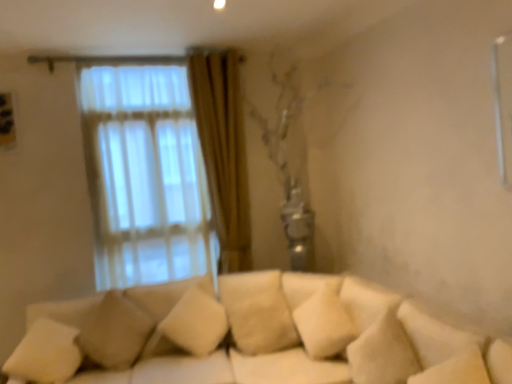
Question: Is white soft pillow at lower left, which appears as the 3th pillow when viewed from the right, a part of beige fabric pillow at center, the third pillow when ordered from left to right?

Choices:
 (A) no
 (B) yes

Answer: (A)

Question: Can you confirm if beige fabric pillow at center, the third pillow when ordered from left to right, is smaller than white soft pillow at lower left, which appears as the 3th pillow when viewed from the right?

Choices:
 (A) no
 (B) yes

Answer: (A)

Question: Is the position of beige fabric pillow at center, the first pillow from the right, less distant than that of white soft pillow at lower left, which is the 1th pillow in left-to-right order?

Choices:
 (A) no
 (B) yes

Answer: (A)

Question: Can you confirm if beige fabric pillow at center, the third pillow when ordered from left to right, is thinner than white soft pillow at lower left, which is the 1th pillow in left-to-right order?

Choices:
 (A) no
 (B) yes

Answer: (A)

Question: Considering the relative sizes of beige fabric pillow at center, the first pillow from the right, and white soft pillow at lower left, which appears as the 3th pillow when viewed from the right, in the image provided, is beige fabric pillow at center, the first pillow from the right, bigger than white soft pillow at lower left, which appears as the 3th pillow when viewed from the right,?

Choices:
 (A) yes
 (B) no

Answer: (A)

Question: From a real-world perspective, is beige fabric pillow at lower left, the second pillow viewed from the right, physically located above or below white soft pillow at lower left, which is the 1th pillow in left-to-right order?

Choices:
 (A) below
 (B) above

Answer: (B)

Question: Is beige fabric pillow at lower left, the second pillow viewed from the right, spatially inside white soft pillow at lower left, which is the 1th pillow in left-to-right order, or outside of it?

Choices:
 (A) inside
 (B) outside

Answer: (B)

Question: Relative to white soft pillow at lower left, which appears as the 3th pillow when viewed from the right, is beige fabric pillow at lower left, the second pillow viewed from the right, in front or behind?

Choices:
 (A) front
 (B) behind

Answer: (B)

Question: From the image's perspective, is beige fabric pillow at lower left, the second pillow viewed from the right, positioned above or below white soft pillow at lower left, which is the 1th pillow in left-to-right order?

Choices:
 (A) above
 (B) below

Answer: (A)

Question: In terms of height, does white soft pillow at lower left, which is the 1th pillow in left-to-right order, look taller or shorter compared to beige fabric pillow at lower left, which is the 2th pillow from left to right?

Choices:
 (A) tall
 (B) short

Answer: (B)

Question: Is white soft pillow at lower left, which appears as the 3th pillow when viewed from the right, wider or thinner than beige fabric pillow at lower left, the second pillow viewed from the right?

Choices:
 (A) wide
 (B) thin

Answer: (A)

Question: Based on their positions, is white soft pillow at lower left, which appears as the 3th pillow when viewed from the right, located to the left or right of beige fabric pillow at lower left, which is the 2th pillow from left to right?

Choices:
 (A) left
 (B) right

Answer: (A)

Question: From the image's perspective, relative to beige fabric pillow at lower left, which is the 2th pillow from left to right, is white soft pillow at lower left, which is the 1th pillow in left-to-right order, above or below?

Choices:
 (A) above
 (B) below

Answer: (B)

Question: Considering their positions, is beige fabric pillow at lower left, which is the 2th pillow from left to right, located in front of or behind beige fabric pillow at center, the third pillow when ordered from left to right?

Choices:
 (A) behind
 (B) front

Answer: (B)

Question: Is beige fabric pillow at lower left, the second pillow viewed from the right, to the left or to the right of beige fabric pillow at center, the third pillow when ordered from left to right, in the image?

Choices:
 (A) right
 (B) left

Answer: (B)